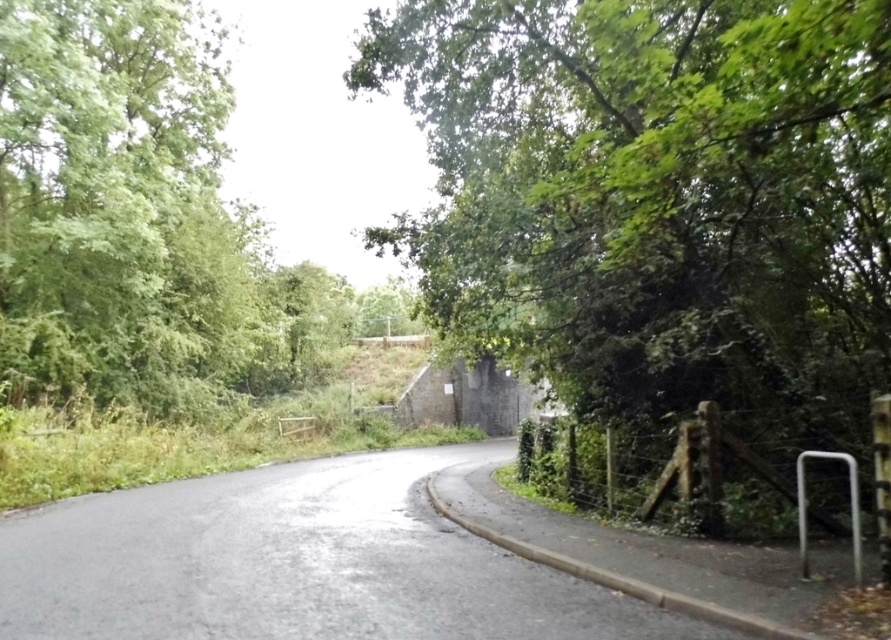
You are a hiker standing on the road and want to take a photo of both the green leafy tree at center and the green leafy tree at left. Which tree should you move towards to get both in the frame without changing your camera angle?

You should move towards the green leafy tree at left because the green leafy tree at center is closer to the viewer, so moving towards the farther tree would help balance their positions in the frame.

You are standing on the road and see the green leafy tree at center and the green leafy tree at left. Which tree is positioned to the right of the other?

The green leafy tree at center is to the right of the green leafy tree at left.

You are a hiker trying to navigate the narrow path between the green leafy tree at center and the green leafy tree at left. Which tree has a narrower trunk?

The green leafy tree at center is thinner than the green leafy tree at left, so the green leafy tree at center has a narrower trunk.